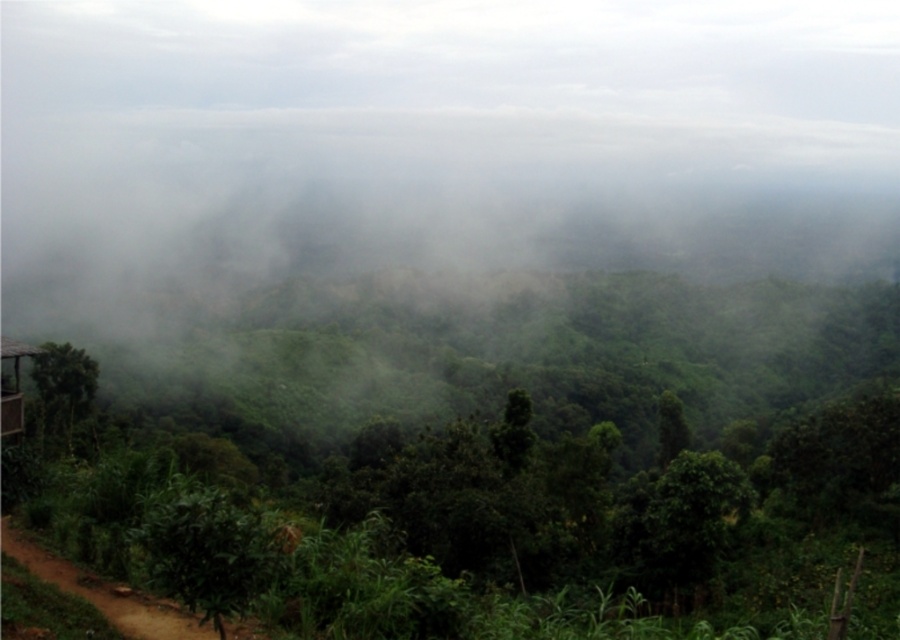
You are standing at the viewpoint of the image and want to reach the two points marked in the scene. Which point, point [64,388] or point [659,396], is closer to you?

Point [64,388] is closer to the viewer than point [659,396].

You are a hiker trying to navigate through the misty forest. You see the green matte fog at center and the green leafy tree at lower left. Which one is taller from your perspective?

The green matte fog at center is much taller than the green leafy tree at lower left.

You are a hiker planning to take a photo of the green matte fog at center in the misty landscape. Where should you position yourself to capture the fog in the center of your camera frame?

Position yourself so that the green matte fog at center is centered at coordinates approximately 0.220 on the horizontal axis and 0.487 on the vertical axis to capture it in the center of your camera frame.